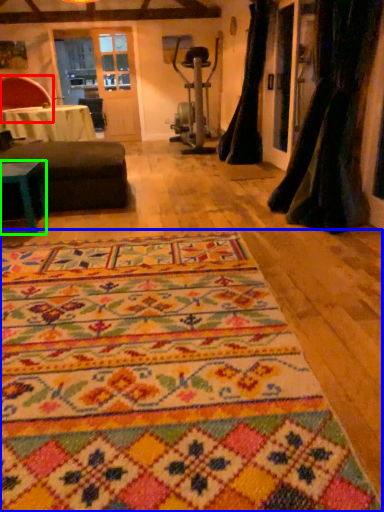
Question: Considering the real-world distances, which object is farthest from chair (highlighted by a red box)? mat (highlighted by a blue box) or table (highlighted by a green box)?

Choices:
 (A) mat
 (B) table

Answer: (A)